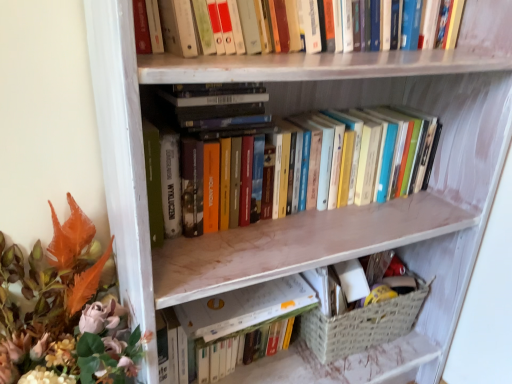
Question: From a real-world perspective, is woven beige basket at lower right physically below matte orange leaves at left?

Choices:
 (A) yes
 (B) no

Answer: (A)

Question: From the image's perspective, does woven beige basket at lower right appear higher than matte orange leaves at left?

Choices:
 (A) no
 (B) yes

Answer: (B)

Question: Can you confirm if woven beige basket at lower right is positioned to the right of matte orange leaves at left?

Choices:
 (A) yes
 (B) no

Answer: (A)

Question: Could you tell me if woven beige basket at lower right is turned towards matte orange leaves at left?

Choices:
 (A) no
 (B) yes

Answer: (A)

Question: Is woven beige basket at lower right outside of matte orange leaves at left?

Choices:
 (A) yes
 (B) no

Answer: (A)

Question: Is hardcover books at center, which is the second book from top to bottom, in front of or behind matte orange leaves at left in the image?

Choices:
 (A) front
 (B) behind

Answer: (B)

Question: From a real-world perspective, relative to matte orange leaves at left, is hardcover books at center, the 1th book from the bottom, vertically above or below?

Choices:
 (A) below
 (B) above

Answer: (B)

Question: In terms of height, does hardcover books at center, which is the second book from top to bottom, look taller or shorter compared to matte orange leaves at left?

Choices:
 (A) short
 (B) tall

Answer: (A)

Question: Based on their sizes in the image, would you say hardcover books at center, which is the second book from top to bottom, is bigger or smaller than matte orange leaves at left?

Choices:
 (A) big
 (B) small

Answer: (B)

Question: Do you think matte orange leaves at left is within woven beige basket at lower right, or outside of it?

Choices:
 (A) outside
 (B) inside

Answer: (A)

Question: In the image, is matte orange leaves at left on the left side or the right side of woven beige basket at lower right?

Choices:
 (A) left
 (B) right

Answer: (A)

Question: Looking at their shapes, would you say matte orange leaves at left is wider or thinner than woven beige basket at lower right?

Choices:
 (A) thin
 (B) wide

Answer: (B)

Question: In terms of size, does matte orange leaves at left appear bigger or smaller than woven beige basket at lower right?

Choices:
 (A) big
 (B) small

Answer: (A)

Question: In terms of size, does hardcover book at center appear bigger or smaller than matte orange leaves at left?

Choices:
 (A) small
 (B) big

Answer: (A)

Question: From the image's perspective, is hardcover book at center located above or below matte orange leaves at left?

Choices:
 (A) above
 (B) below

Answer: (A)